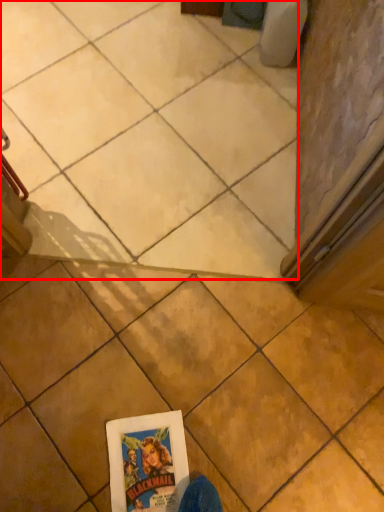
Question: From the image's perspective, what is the correct spatial relationship of tile (annotated by the red box) in relation to tile?

Choices:
 (A) below
 (B) above

Answer: (B)